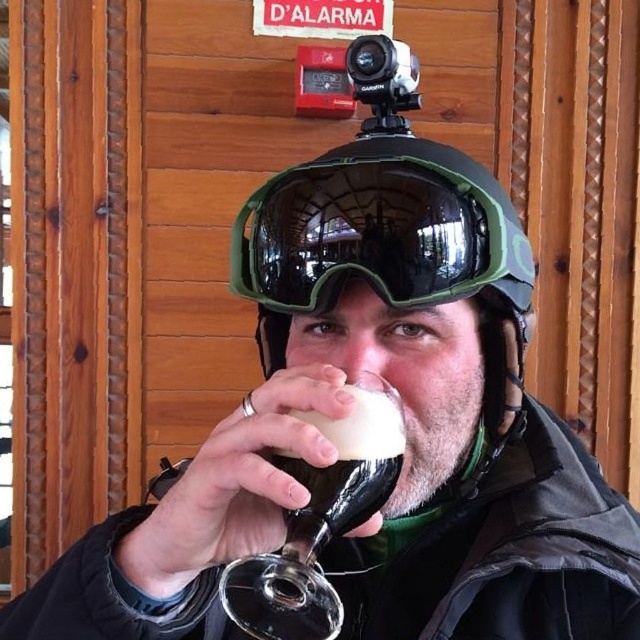
Question: Which of the following is the farthest from the observer?

Choices:
 (A) (381, 163)
 (B) (282, 634)

Answer: (A)

Question: Based on their relative distances, which object is nearer to the green matte/glossy goggles at center?

Choices:
 (A) green matte helmet at center
 (B) translucent glass wine glass at center

Answer: (A)

Question: Is green matte/glossy goggles at center wider than translucent glass wine glass at center?

Choices:
 (A) yes
 (B) no

Answer: (A)

Question: Is green matte helmet at center smaller than translucent glass wine glass at center?

Choices:
 (A) yes
 (B) no

Answer: (B)

Question: Is green matte helmet at center further to the viewer compared to translucent glass wine glass at center?

Choices:
 (A) no
 (B) yes

Answer: (B)

Question: Which of the following is the closest to the observer?

Choices:
 (A) (417, 156)
 (B) (464, 464)

Answer: (A)